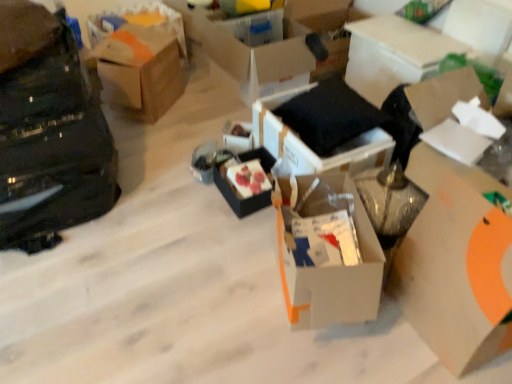
Find the location of a particular element. This screenshot has height=384, width=512. free location to the right of brown cardboard box at upper left, arranged as the eighth box when viewed from the right is located at coordinates (202, 107).